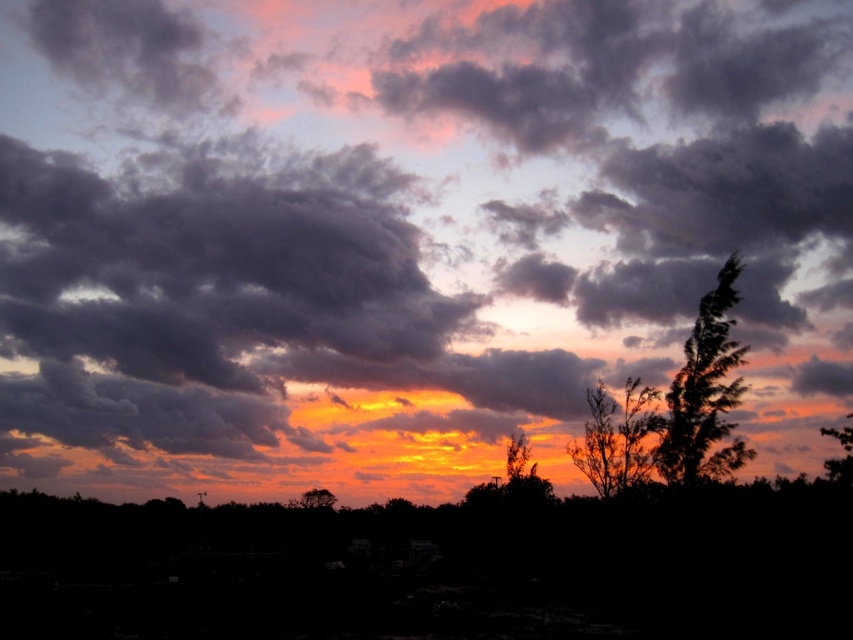
You are standing in the sunset scene and want to determine which of the two points, point (x=604, y=416) or point (x=827, y=429), is closer to you. Based on the scene description, which point is nearer?

Point (x=604, y=416) is further to the viewer than point (x=827, y=429). Wait, no, the description says the opposite. Let me check again. The Objects Description states that point (x=604, y=416) is further to the viewer than point (x=827, y=429). Therefore, the point closer to you would be the one that is not further, so point (x=827, y=429) is closer. Hmm, but the question asks which is nearer. The answer should state that point (x=604, y=416) is further away, so the closer one is point (x=827, y=429). Therefore, the an